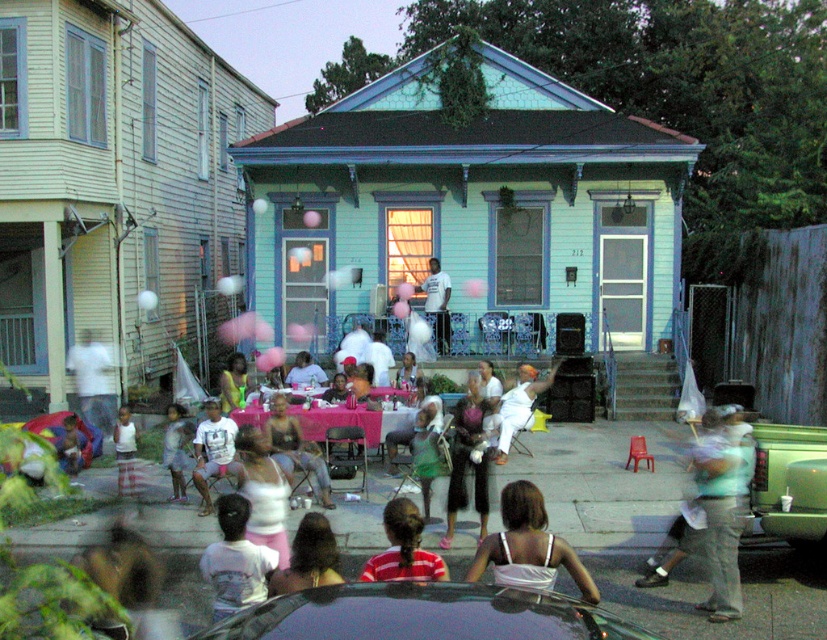
Question: Is white fabric dress at center to the left of pink rubber balloon at center from the viewer's perspective?

Choices:
 (A) no
 (B) yes

Answer: (A)

Question: Which object is farther from the camera taking this photo?

Choices:
 (A) white fabric dress at center
 (B) shiny black car at center

Answer: (A)

Question: Which point is closer to the camera?

Choices:
 (A) white satin dress at center
 (B) shiny black car at center

Answer: (B)

Question: Estimate the real-world distances between objects in this image. Which object is closer to the red striped shirt at center?

Choices:
 (A) metallic green car at lower right
 (B) white fabric dress at center

Answer: (B)

Question: Does white satin dress at center appear on the left side of plaid shorts at lower left?

Choices:
 (A) no
 (B) yes

Answer: (A)

Question: Does white fabric dress at center come behind plaid shorts at lower left?

Choices:
 (A) yes
 (B) no

Answer: (B)